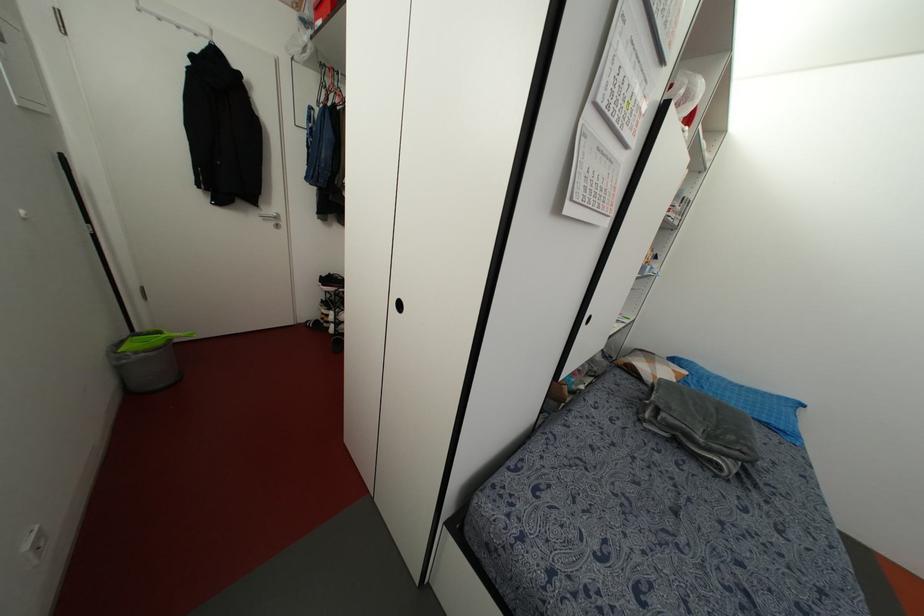
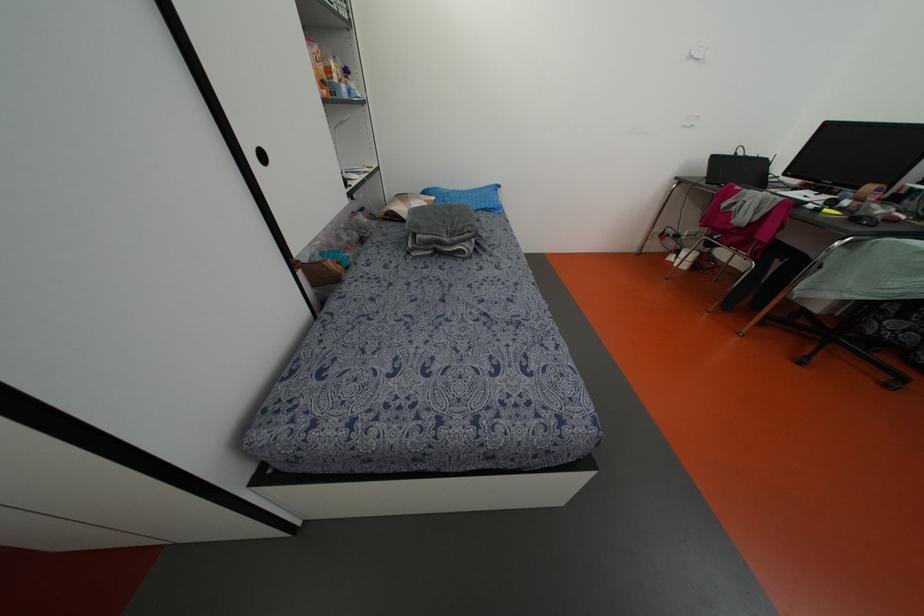
Locate, in the second image, the point that corresponds to (663,415) in the first image.

(418, 236)